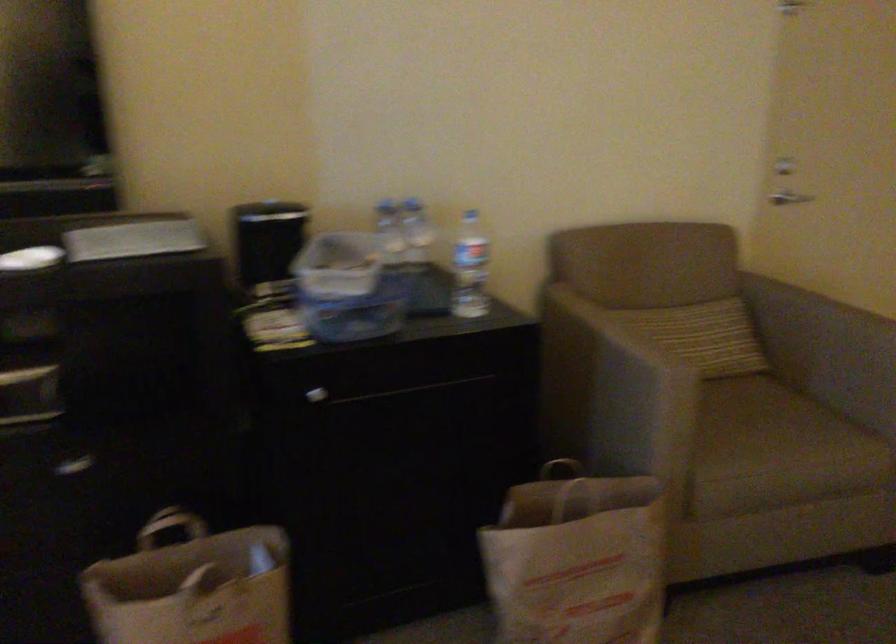
Find the location of a particular element. This screenshot has height=644, width=896. plastic food container is located at coordinates (348, 288).